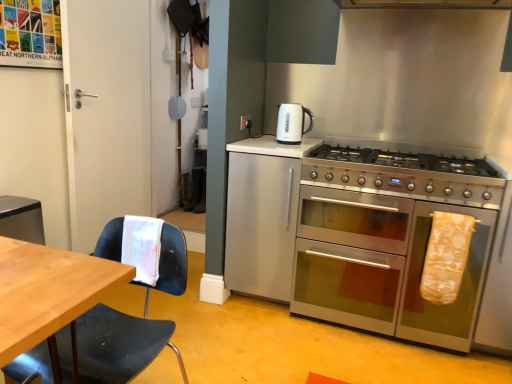
You are a GUI agent. You are given a task and a screenshot of the screen. Output one action in this format:
    pyautogui.click(x=<x>, y=<y>)
    Task: Click on the white paper towel at left, the 1th material viewed from the front
    Image resolution: width=512 pixels, height=384 pixels.
    Given the screenshot: What is the action you would take?
    pyautogui.click(x=142, y=247)

Describe the element at coordinates (142, 247) in the screenshot. I see `white paper towel at left, the second material when ordered from back to front` at that location.

At what (x,y) coordinates should I click in order to perform the action: click on stainless steel oven at right. Please return your answer as a coordinate pair (x, y). Looking at the image, I should click on (390, 239).

What is the approximate height of stainless steel gas stove at right?

stainless steel gas stove at right is 8.05 inches tall.

Identify the location of satin silver cabinet at center. This screenshot has width=512, height=384. (262, 215).

You are a GUI agent. You are given a task and a screenshot of the screen. Output one action in this format:
    pyautogui.click(x=<x>, y=<y>)
    Task: Click on the yellow fabric oven mitt at right, which is the 1th material from back to front
    The width and height of the screenshot is (512, 384).
    Given the screenshot: What is the action you would take?
    pyautogui.click(x=446, y=257)

Image resolution: width=512 pixels, height=384 pixels. Find the location of `black plastic chair at left`. black plastic chair at left is located at coordinates (119, 344).

The image size is (512, 384). Find the location of `white paper towel at left, which appears as the 2th material when viewed from the right`. white paper towel at left, which appears as the 2th material when viewed from the right is located at coordinates (142, 247).

Considering the sizes of objects stainless steel oven at right and white glossy electric kettle at upper center in the image provided, who is wider, stainless steel oven at right or white glossy electric kettle at upper center?

With larger width is stainless steel oven at right.

Is stainless steel oven at right next to white glossy electric kettle at upper center?

No, stainless steel oven at right is not making contact with white glossy electric kettle at upper center.

Looking at this image, in terms of height, does stainless steel oven at right look taller or shorter compared to white glossy electric kettle at upper center?

stainless steel oven at right is taller than white glossy electric kettle at upper center.

Looking at the image, does stainless steel oven at right seem bigger or smaller compared to white glossy electric kettle at upper center?

Considering their sizes, stainless steel oven at right takes up more space than white glossy electric kettle at upper center.

This screenshot has height=384, width=512. I want to click on chair above the stainless steel oven at right (from a real-world perspective), so click(x=119, y=344).

How many degrees apart are the facing directions of black plastic chair at left and stainless steel oven at right?

The angle between the facing direction of black plastic chair at left and the facing direction of stainless steel oven at right is 0.316 degrees.

From the image's perspective, would you say black plastic chair at left is positioned over stainless steel oven at right?

No.

Which object is further away from the camera, black plastic chair at left or stainless steel oven at right?

stainless steel oven at right is further from the camera.

From the image's perspective, is white paper towel at left, which appears as the 2th material when viewed from the right, above or below yellow fabric oven mitt at right, which is the second material from left to right?

white paper towel at left, which appears as the 2th material when viewed from the right, is situated higher than yellow fabric oven mitt at right, which is the second material from left to right, in the image.

Which of these two, white paper towel at left, which appears as the 2th material when viewed from the right, or yellow fabric oven mitt at right, the first material viewed from the right, is thinner?

With smaller width is yellow fabric oven mitt at right, the first material viewed from the right.

Looking at this image, can you tell me how much white paper towel at left, the second material when ordered from back to front, and yellow fabric oven mitt at right, which is the 1th material from back to front, differ in facing direction?

The angle between the facing direction of white paper towel at left, the second material when ordered from back to front, and the facing direction of yellow fabric oven mitt at right, which is the 1th material from back to front, is 2.38 degrees.

Considering the relative sizes of white paper towel at left, which appears as the 2th material when viewed from the right, and yellow fabric oven mitt at right, which is the second material from left to right, in the image provided, is white paper towel at left, which appears as the 2th material when viewed from the right, shorter than yellow fabric oven mitt at right, which is the second material from left to right,?

Yes.

Could you measure the distance between stainless steel oven at right and white paper towel at left, the first material from the left?

stainless steel oven at right is 1.09 meters away from white paper towel at left, the first material from the left.

From a real-world perspective, does stainless steel oven at right stand above white paper towel at left, the second material when ordered from back to front?

No, from a real-world perspective, stainless steel oven at right is not on top of white paper towel at left, the second material when ordered from back to front.

Can you confirm if stainless steel oven at right is positioned to the left of white paper towel at left, the second material when ordered from back to front?

No, stainless steel oven at right is not to the left of white paper towel at left, the second material when ordered from back to front.

Is stainless steel oven at right with white paper towel at left, the 1th material viewed from the front?

There is a gap between stainless steel oven at right and white paper towel at left, the 1th material viewed from the front.

How many degrees apart are the facing directions of stainless steel gas stove at right and white glossy electric kettle at upper center?

They differ by 0.795 degrees in their facing directions.

This screenshot has height=384, width=512. What are the coordinates of `kitchen appliance that appears above the stainless steel gas stove at right (from the image's perspective)` in the screenshot? It's located at (292, 123).

Is stainless steel gas stove at right not inside white glossy electric kettle at upper center?

Yes, stainless steel gas stove at right is outside of white glossy electric kettle at upper center.

Considering the relative positions of stainless steel gas stove at right and white glossy electric kettle at upper center in the image provided, is stainless steel gas stove at right behind white glossy electric kettle at upper center?

No, the depth of stainless steel gas stove at right is less than that of white glossy electric kettle at upper center.

Considering the positions of objects white glossy electric kettle at upper center and satin silver cabinet at center in the image provided, who is behind, white glossy electric kettle at upper center or satin silver cabinet at center?

Positioned behind is white glossy electric kettle at upper center.

Looking at this image, is white glossy electric kettle at upper center oriented away from satin silver cabinet at center?

No.

From the image's perspective, who appears lower, white glossy electric kettle at upper center or satin silver cabinet at center?

satin silver cabinet at center appears lower in the image.

In the scene shown: Is satin silver cabinet at center turned away from stainless steel gas stove at right?

No, satin silver cabinet at center is not facing the opposite direction of stainless steel gas stove at right.

Does point (273, 150) appear closer or farther from the camera than point (350, 170)?

Clearly, point (273, 150) is more distant from the camera than point (350, 170).

Considering the positions of objects satin silver cabinet at center and stainless steel gas stove at right in the image provided, who is more to the left, satin silver cabinet at center or stainless steel gas stove at right?

satin silver cabinet at center is more to the left.

How distant is satin silver cabinet at center from stainless steel gas stove at right?

satin silver cabinet at center is 17.54 inches from stainless steel gas stove at right.

You are a GUI agent. You are given a task and a screenshot of the screen. Output one action in this format:
    pyautogui.click(x=<x>, y=<y>)
    Task: Click on the kitchen appliance above the stainless steel oven at right (from a real-world perspective)
    The image size is (512, 384).
    Given the screenshot: What is the action you would take?
    pyautogui.click(x=292, y=123)

At what (x,y) coordinates should I click in order to perform the action: click on chair in front of the stainless steel oven at right. Please return your answer as a coordinate pair (x, y). The width and height of the screenshot is (512, 384). Looking at the image, I should click on (119, 344).

Estimate the real-world distances between objects in this image. Which object is further from white paper towel at left, the first material from the left, white matte door at left or yellow fabric oven mitt at right, the first material viewed from the right?

white matte door at left.

From the image, which object appears to be farther from stainless steel gas stove at right, yellow fabric oven mitt at right, which is the second material from left to right, or white matte door at left?

white matte door at left is positioned further to the anchor stainless steel gas stove at right.

Based on their spatial positions, is white glossy electric kettle at upper center or satin silver cabinet at center further from yellow fabric oven mitt at right, the first material viewed from the right?

The object further to yellow fabric oven mitt at right, the first material viewed from the right, is white glossy electric kettle at upper center.

When comparing their distances from satin silver cabinet at center, does stainless steel oven at right or stainless steel gas stove at right seem closer?

stainless steel oven at right is closer to satin silver cabinet at center.

Which object lies nearer to the anchor point stainless steel oven at right, white glossy electric kettle at upper center or yellow fabric oven mitt at right, which is the 1th material from back to front?

Based on the image, yellow fabric oven mitt at right, which is the 1th material from back to front, appears to be nearer to stainless steel oven at right.

Based on their spatial positions, is black plastic chair at left or white glossy electric kettle at upper center further from white paper towel at left, the 1th material viewed from the front?

Among the two, white glossy electric kettle at upper center is located further to white paper towel at left, the 1th material viewed from the front.

Estimate the real-world distances between objects in this image. Which object is closer to stainless steel oven at right, white matte door at left or black plastic chair at left?

black plastic chair at left lies closer to stainless steel oven at right than the other object.

When comparing their distances from white matte door at left, does white paper towel at left, the second material when ordered from back to front, or stainless steel gas stove at right seem closer?

white paper towel at left, the second material when ordered from back to front.

Locate an element on the screen. The height and width of the screenshot is (384, 512). material located between black plastic chair at left and stainless steel oven at right in the left-right direction is located at coordinates (142, 247).

You are a GUI agent. You are given a task and a screenshot of the screen. Output one action in this format:
    pyautogui.click(x=<x>, y=<y>)
    Task: Click on the material between white matte door at left and yellow fabric oven mitt at right, which is the second material from left to right
    The width and height of the screenshot is (512, 384).
    Given the screenshot: What is the action you would take?
    pyautogui.click(x=142, y=247)

Find the location of `cabinetry between white matte door at left and white glossy electric kettle at upper center`. cabinetry between white matte door at left and white glossy electric kettle at upper center is located at coordinates (262, 215).

Where is `oven situated between satin silver cabinet at center and stainless steel gas stove at right from left to right`? Image resolution: width=512 pixels, height=384 pixels. oven situated between satin silver cabinet at center and stainless steel gas stove at right from left to right is located at coordinates (390, 239).